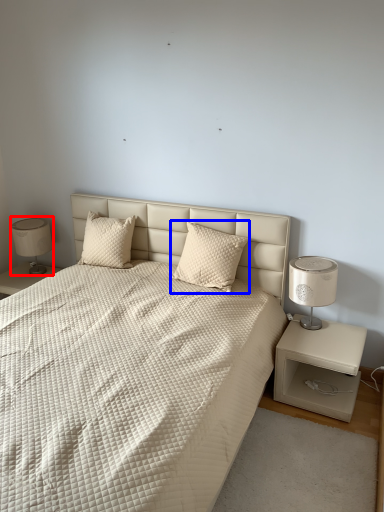
Question: Which object is closer to the camera taking this photo, table lamp (highlighted by a red box) or pillow (highlighted by a blue box)?

Choices:
 (A) table lamp
 (B) pillow

Answer: (B)